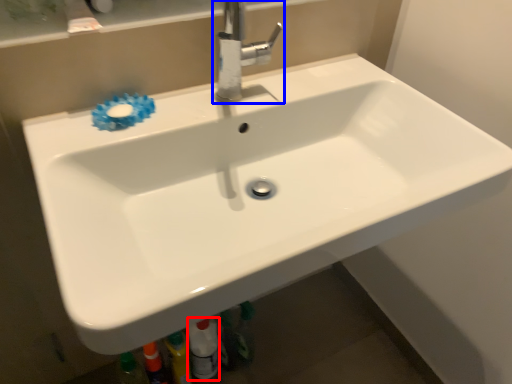
Question: Which object appears closest to the camera in this image, toiletry (highlighted by a red box) or tap (highlighted by a blue box)?

Choices:
 (A) toiletry
 (B) tap

Answer: (B)